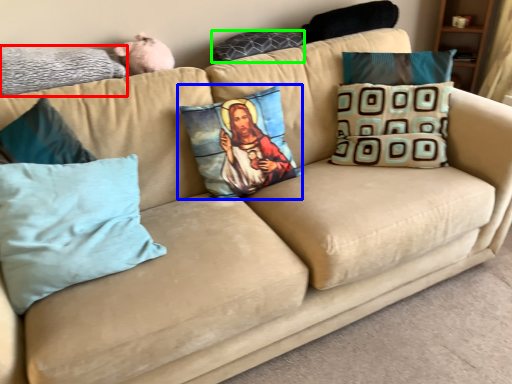
Question: Estimate the real-world distances between objects in this image. Which object is farther from pillow (highlighted by a red box), pillow (highlighted by a blue box) or pillow (highlighted by a green box)?

Choices:
 (A) pillow
 (B) pillow

Answer: (B)